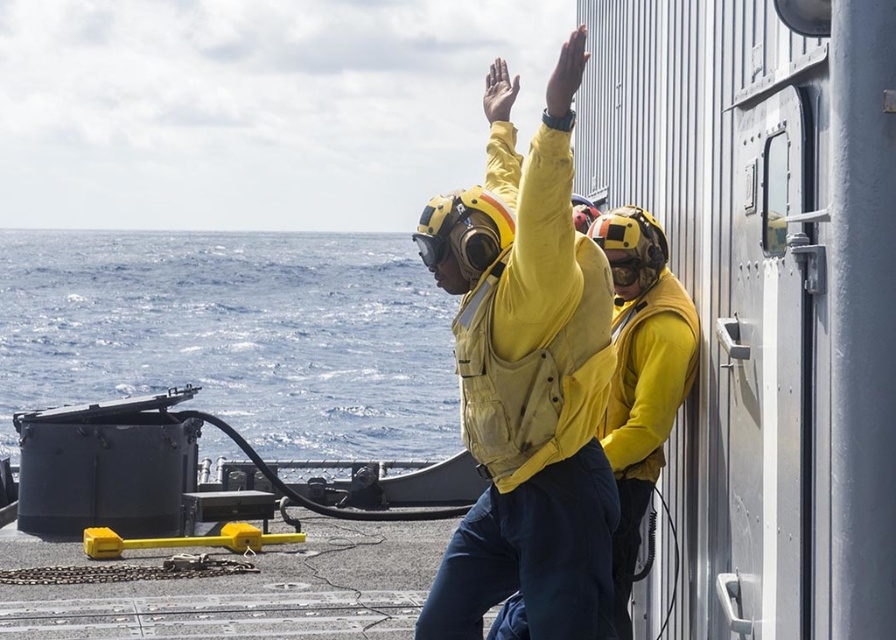
You are a sailor on the deck of the naval ship. You see the blue water at left and the yellow matte life vest at center. Which object is closer to you?

The yellow matte life vest at center is behind the blue water at left, so the blue water at left is closer to you.

Based on the scene description, where exactly is the blue water at left located on the image?

The blue water at left is located at point coordinates of (235, 333).

You are a safety officer on the naval ship deck. You need to ensure that the yellow matte life vest at center is within a 50 meter safety zone from the blue water at left. Is the current placement compliant with safety regulations?

The distance between the blue water at left and the yellow matte life vest at center is 53.03 meters, which exceeds the 50 meter safety zone requirement. Therefore, the current placement is not compliant with safety regulations.